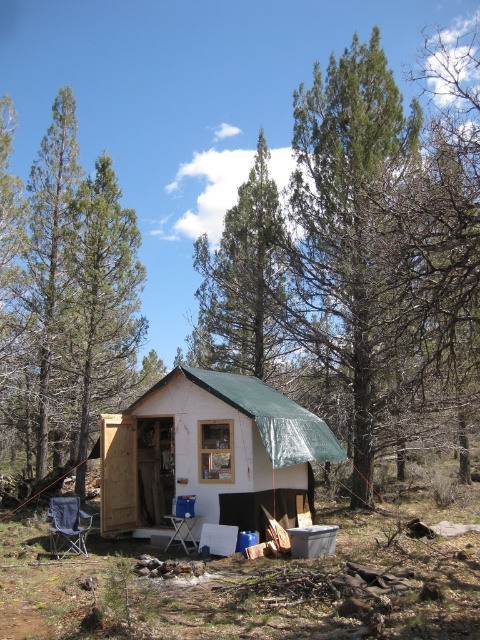
Question: Which point appears closest to the camera in this image?

Choices:
 (A) (226, 256)
 (B) (49, 506)
 (C) (355, 168)
 (D) (254, 444)

Answer: (D)

Question: Can you confirm if white matte cabin at center is smaller than green coniferous tree at center?

Choices:
 (A) yes
 (B) no

Answer: (A)

Question: Which point appears farthest from the camera in this image?

Choices:
 (A) (334, 362)
 (B) (73, 212)
 (C) (237, 225)

Answer: (C)

Question: Which point is farther to the camera?

Choices:
 (A) green needle-like at upper left
 (B) green coniferous tree at center

Answer: (B)

Question: Is green coniferous tree at center smaller than blue fabric folding chair at lower left?

Choices:
 (A) no
 (B) yes

Answer: (A)

Question: Does white matte cabin at center have a greater width compared to green coniferous tree at center?

Choices:
 (A) no
 (B) yes

Answer: (B)